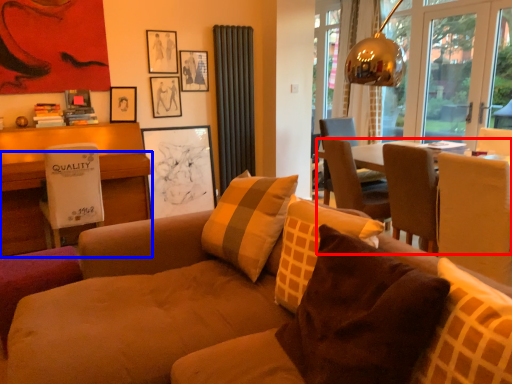
Question: Which point is closer to the camera, table (highlighted by a red box) or desk (highlighted by a blue box)?

Choices:
 (A) table
 (B) desk

Answer: (A)